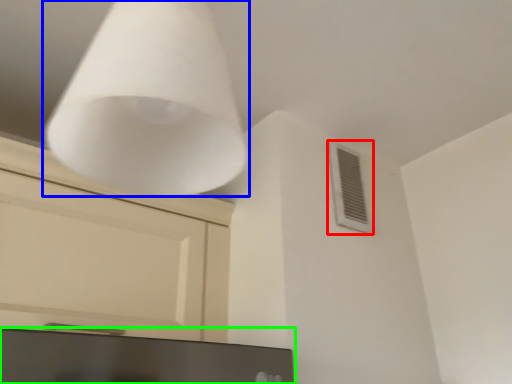
Question: Which object is positioned farthest from air conditioning (highlighted by a red box)? Select from lamp (highlighted by a blue box) and computer monitor (highlighted by a green box).

Choices:
 (A) lamp
 (B) computer monitor

Answer: (A)